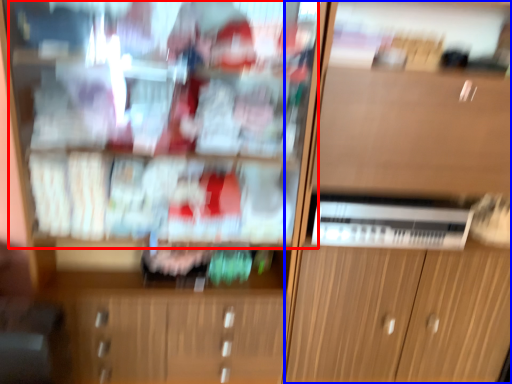
Question: Which of the following is the farthest to the observer, shelf (highlighted by a red box) or cabinetry (highlighted by a blue box)?

Choices:
 (A) shelf
 (B) cabinetry

Answer: (B)